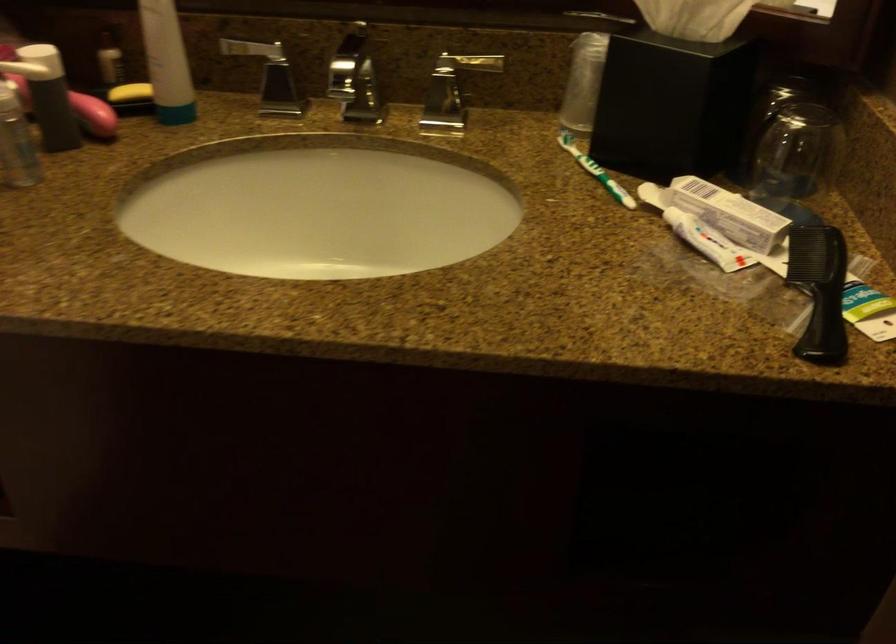
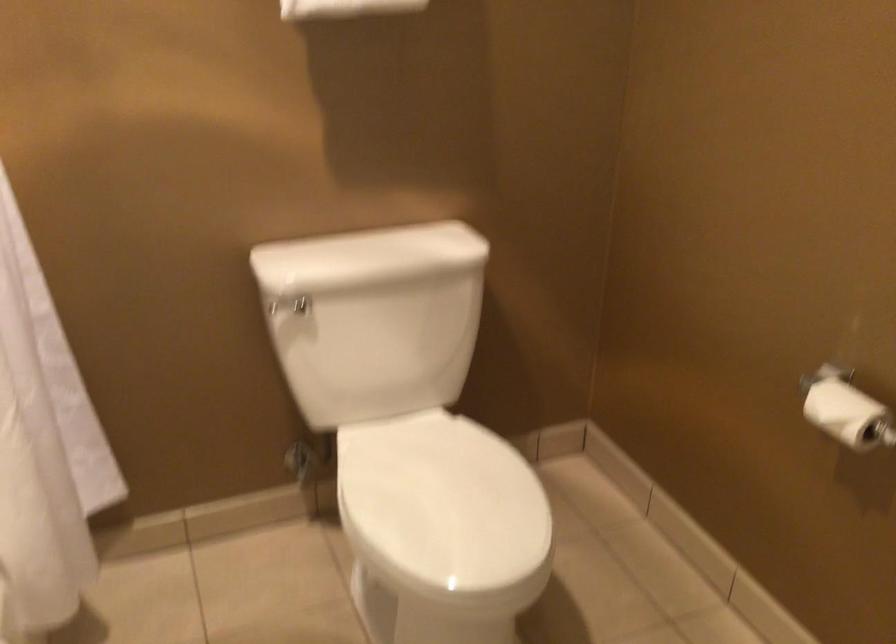
Question: The images are taken continuously from a first-person perspective. In which direction is your viewpoint rotating?

Choices:
 (A) Left
 (B) Right
 (C) Up
 (D) Down

Answer: (A)